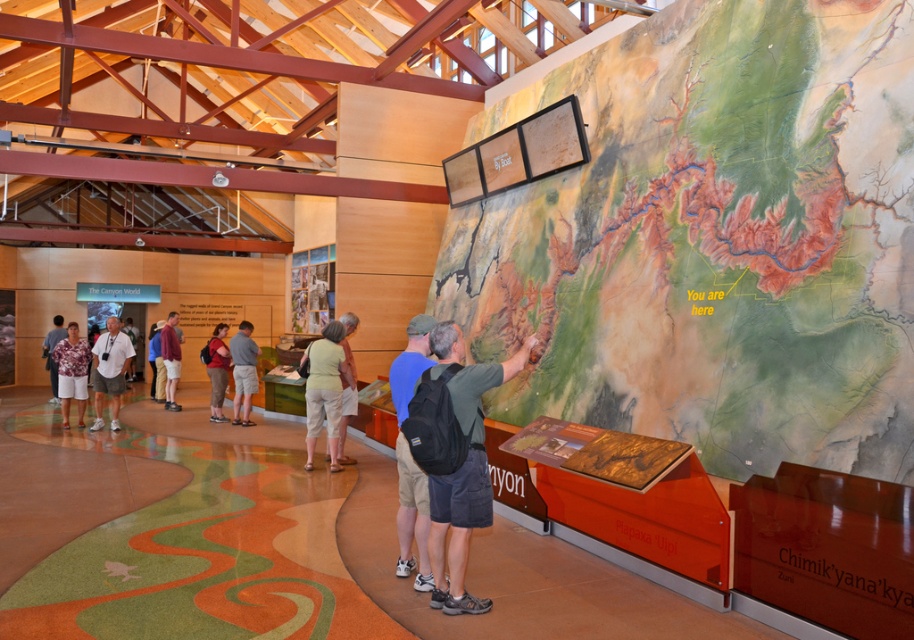
Can you confirm if matte blue shirt at center is taller than matte red backpack at center?

Indeed, matte blue shirt at center has a greater height compared to matte red backpack at center.

Does matte blue shirt at center have a greater width compared to matte red backpack at center?

No.

Between point (417, 588) and point (226, 371), which one is positioned behind?

The point (226, 371) is behind.

I want to click on matte blue shirt at center, so click(x=412, y=516).

Between textured paper map at center and matte black backpack at center, which one has more height?

matte black backpack at center

Is textured paper map at center smaller than matte black backpack at center?

Yes, textured paper map at center is smaller than matte black backpack at center.

Locate an element on the screen. textured paper map at center is located at coordinates (714, 240).

Is matte black backpack at center to the left of denim shorts at center from the viewer's perspective?

Incorrect, matte black backpack at center is not on the left side of denim shorts at center.

Is matte black backpack at center wider than denim shorts at center?

No.

Which is behind, point (530, 348) or point (161, 390)?

Positioned behind is point (161, 390).

Find the location of a particular element. Image resolution: width=914 pixels, height=640 pixels. matte black backpack at center is located at coordinates (463, 467).